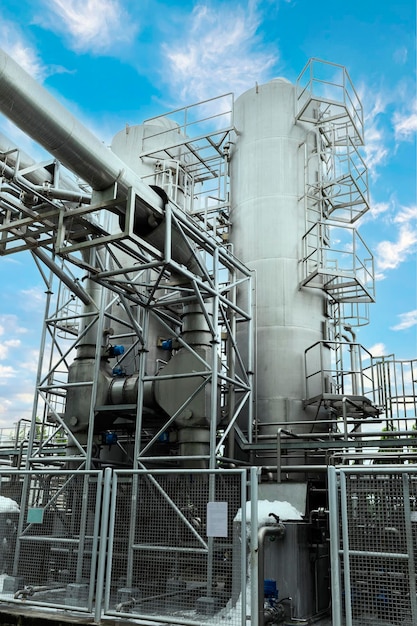
Where is `ladders`? The image size is (417, 626). ladders is located at coordinates (339, 352), (306, 211).